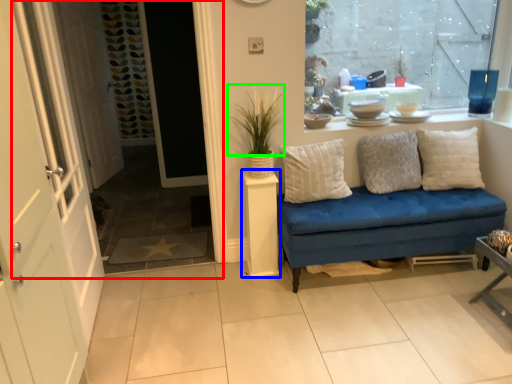
Question: Which is nearer to the window frame (highlighted by a red box)? table (highlighted by a blue box) or plant (highlighted by a green box).

Choices:
 (A) table
 (B) plant

Answer: (A)